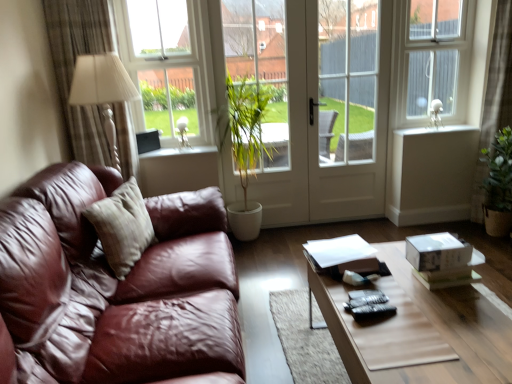
From a real-world perspective, point to the free space above clear glass window at upper left in the image.

[(0.265, -0.001)]